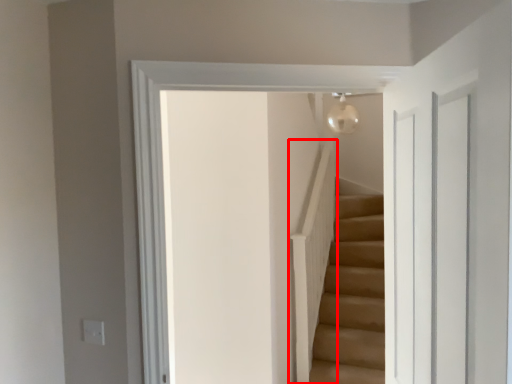
Question: From the image's perspective, what is the correct spatial relationship of balustrade (annotated by the red box) in relation to glass door?

Choices:
 (A) above
 (B) below

Answer: (B)